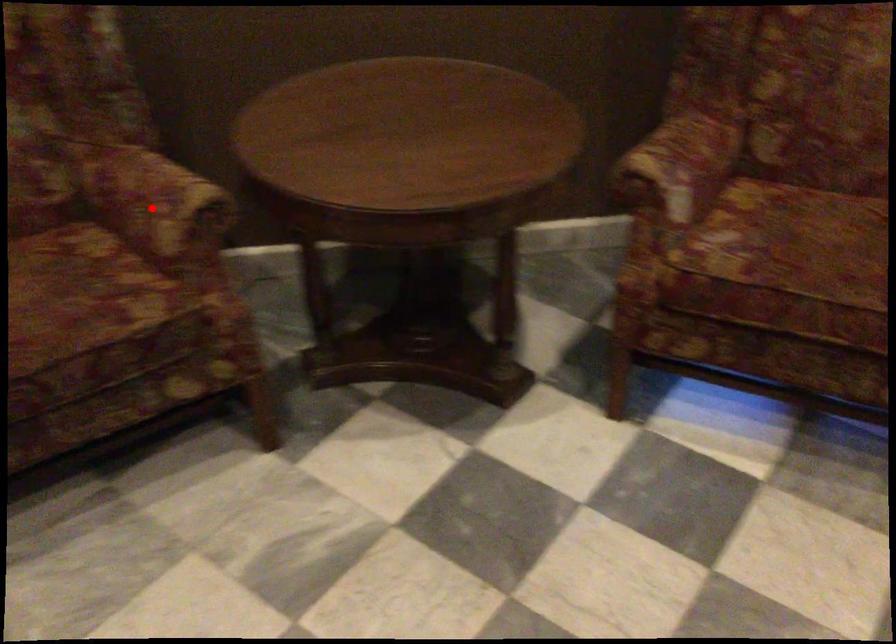
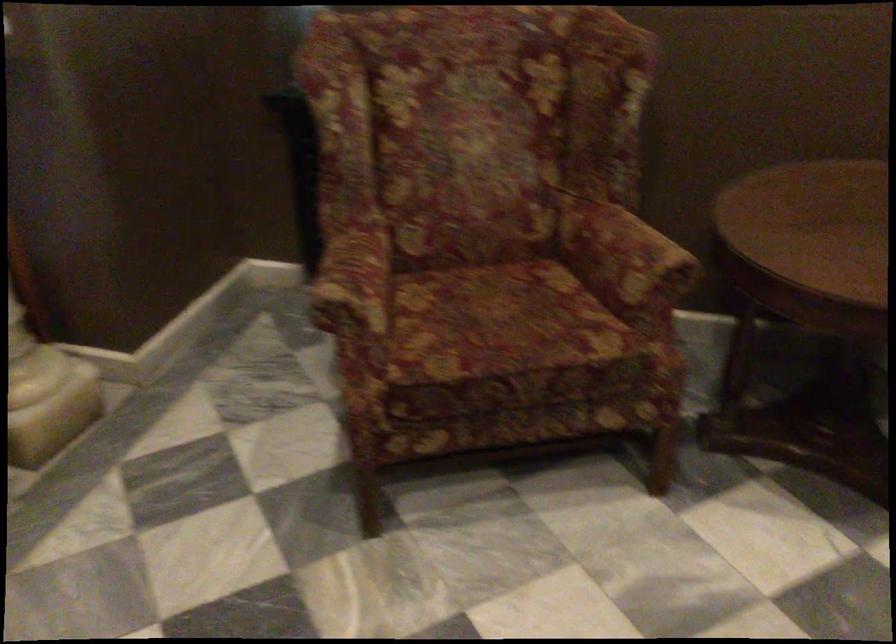
Find the pixel in the second image that matches the highlighted location in the first image.

(624, 258)